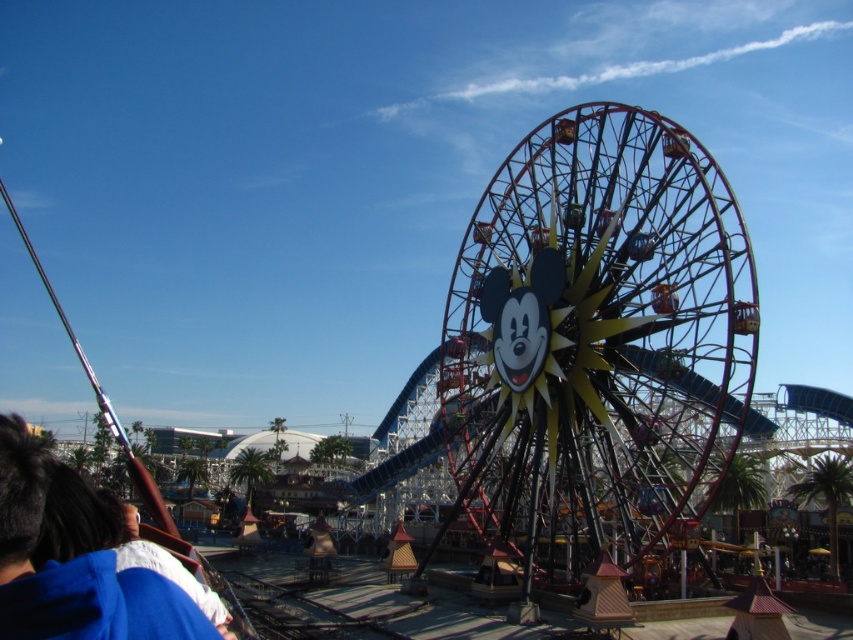
You are a visitor at the amusement park and want to take a photo that includes both the metallic ferris wheel at center and the blue fabric at lower left. Which object should you position closer to the edge of your camera frame to ensure both fit in the photo?

Since the metallic ferris wheel at center is wider than the blue fabric at lower left, you should position the metallic ferris wheel at center closer to the edge of your camera frame to ensure both fit in the photo.

You are a visitor at the amusement park and want to take a photo of the metallic ferris wheel at center and the blue fabric at lower left. Which object should you point your camera towards first to capture both in the same frame?

You should point your camera towards the metallic ferris wheel at center first because it is above the blue fabric at lower left, so adjusting the angle to include both would require framing from the higher object downward.